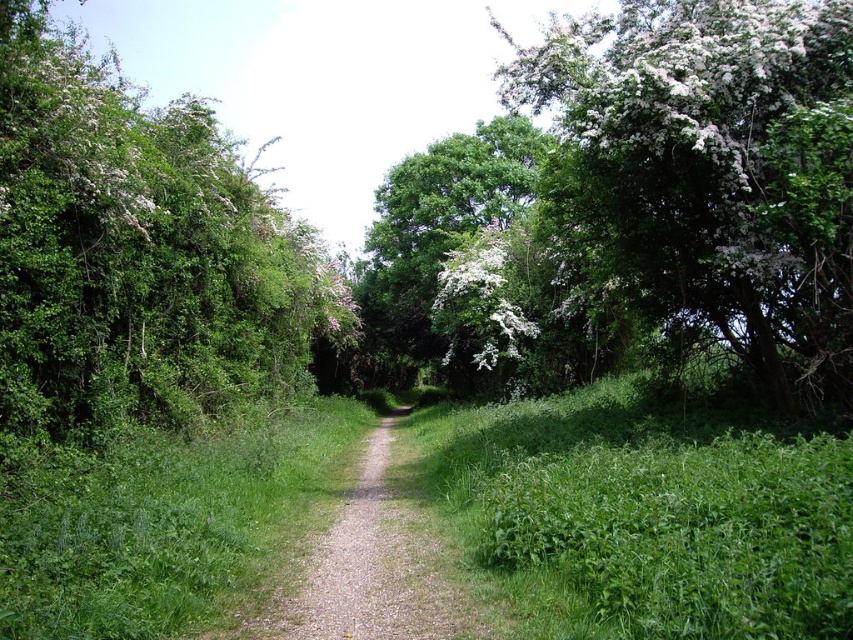
You are standing at the starting point of the path and want to take a photo of the green leafy tree at left. In which direction should you aim your camera to capture it in the frame?

The green leafy tree at left is located at the left side of the scene, so you should aim your camera to the left to capture it in the frame.

You are a hiker trying to stay on the gravel path at center while avoiding the green leafy tree at left. Based on the scene, which direction should you walk to stay on the path and avoid the tree?

The green leafy tree at left is larger in size than gravel path at center, so to stay on the gravel path at center and avoid the tree, you should walk towards the right side of the path where the path curves gently to the right, away from the tree.

You are a hiker standing on the gravel path at center. You want to take a photo of the green leafy tree at left. Which direction should you face to ensure the tree is fully in the frame?

Since the green leafy tree at left is much taller than the gravel path at center, you should face towards the left to ensure the entire height of the green leafy tree at left is captured in your photo.